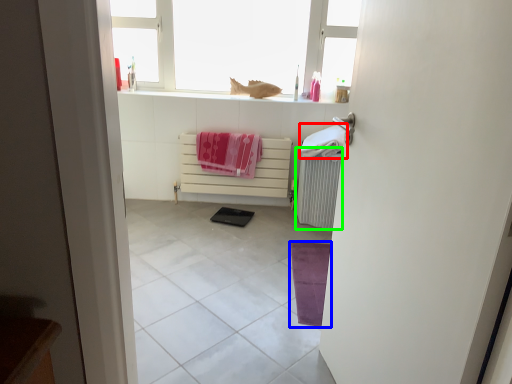
Question: Which object is positioned farthest from beach towel (highlighted by a red box)? Select from yoga mat (highlighted by a blue box) and radiator (highlighted by a green box).

Choices:
 (A) yoga mat
 (B) radiator

Answer: (A)